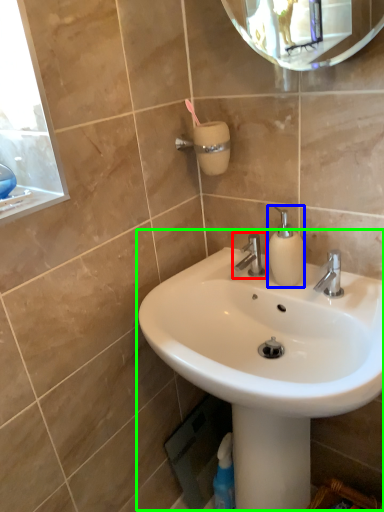
Question: Which object is the closest to the tap (highlighted by a red box)? Choose among these: soap dispenser (highlighted by a blue box) or sink (highlighted by a green box).

Choices:
 (A) soap dispenser
 (B) sink

Answer: (A)